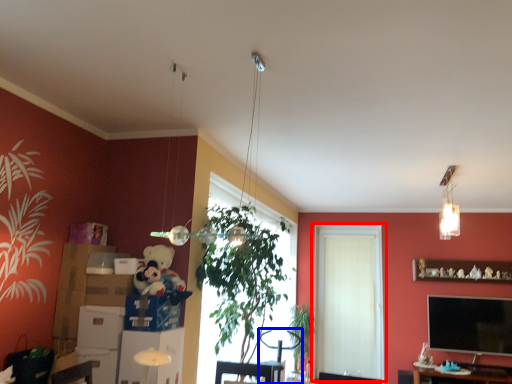
Question: Which point is closer to the camera, window (highlighted by a red box) or swivel chair (highlighted by a blue box)?

Choices:
 (A) window
 (B) swivel chair

Answer: (B)